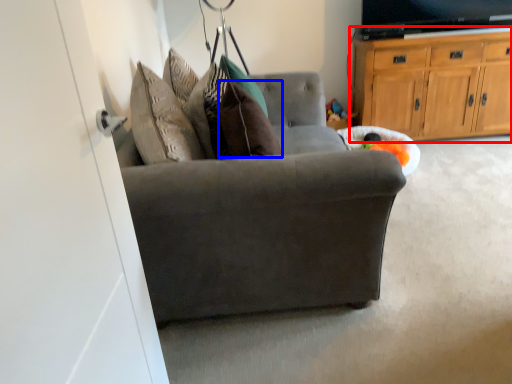
Question: Among these objects, which one is nearest to the camera, cabinetry (highlighted by a red box) or pillow (highlighted by a blue box)?

Choices:
 (A) cabinetry
 (B) pillow

Answer: (B)